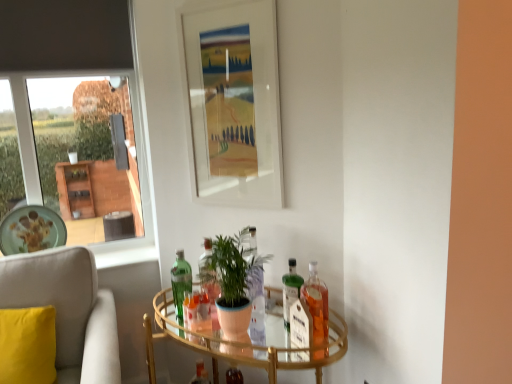
Question: Which direction should I rotate to look at green glass bottle at center, acting as the second bottle starting from the back, — up or down?

Choices:
 (A) up
 (B) down

Answer: (B)

Question: Is clear glass table at center positioned beyond the bounds of translucent glass bottle at center, which is the first bottle from back to front?

Choices:
 (A) no
 (B) yes

Answer: (B)

Question: Is clear glass table at center next to translucent glass bottle at center, the second bottle from the left?

Choices:
 (A) no
 (B) yes

Answer: (A)

Question: Is clear glass table at center taller than translucent glass bottle at center, the third bottle in the right-to-left sequence?

Choices:
 (A) no
 (B) yes

Answer: (B)

Question: Considering the relative positions of clear glass table at center and translucent glass bottle at center, the second bottle from the left, in the image provided, is clear glass table at center to the right of translucent glass bottle at center, the second bottle from the left, from the viewer's perspective?

Choices:
 (A) no
 (B) yes

Answer: (B)

Question: Considering the relative sizes of clear glass table at center and translucent glass bottle at center, the fourth bottle from the front, in the image provided, is clear glass table at center thinner than translucent glass bottle at center, the fourth bottle from the front,?

Choices:
 (A) no
 (B) yes

Answer: (A)

Question: Is clear glass table at center not near translucent glass bottle at center, which is the first bottle from back to front?

Choices:
 (A) yes
 (B) no

Answer: (B)

Question: Can you confirm if green matte plant at center is thinner than soft beige fabric chair at left?

Choices:
 (A) no
 (B) yes

Answer: (B)

Question: From a real-world perspective, is green matte plant at center on soft beige fabric chair at left?

Choices:
 (A) yes
 (B) no

Answer: (A)

Question: Does green matte plant at center lie behind soft beige fabric chair at left?

Choices:
 (A) yes
 (B) no

Answer: (A)

Question: Could you tell me if green matte plant at center is turned towards soft beige fabric chair at left?

Choices:
 (A) yes
 (B) no

Answer: (B)

Question: Is green matte plant at center to the left of soft beige fabric chair at left from the viewer's perspective?

Choices:
 (A) no
 (B) yes

Answer: (A)

Question: Is there a large distance between green matte plant at center and soft beige fabric chair at left?

Choices:
 (A) no
 (B) yes

Answer: (A)

Question: Is matte ceramic plate at left outside translucent glass bottle at right, the first bottle in the front-to-back sequence?

Choices:
 (A) no
 (B) yes

Answer: (B)